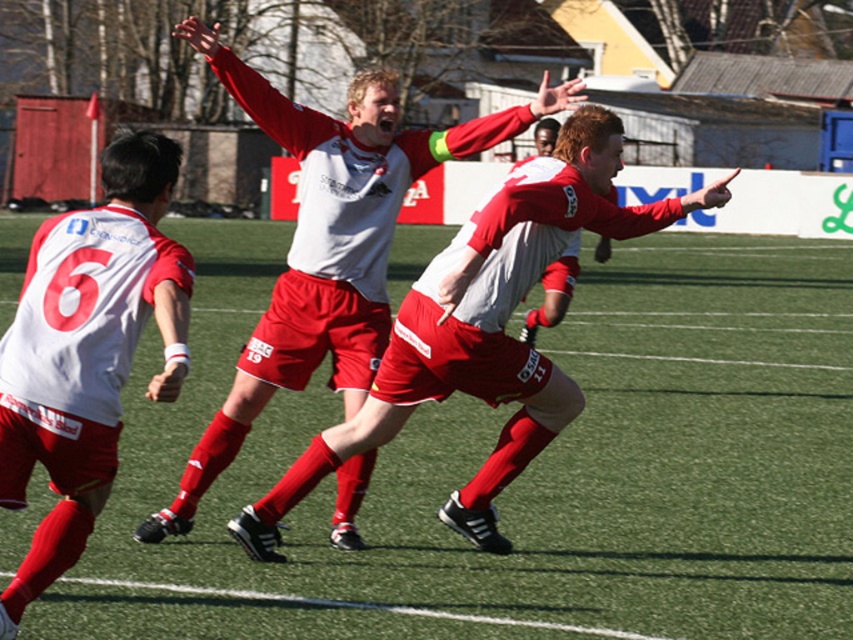
Does matte red shorts at center appear on the right side of white matte jersey at left?

Indeed, matte red shorts at center is positioned on the right side of white matte jersey at left.

Between matte red shorts at center and white matte jersey at left, which one appears on the right side from the viewer's perspective?

matte red shorts at center

Between point (390, 360) and point (57, 330), which one is positioned behind?

The point (390, 360) is more distant.

You are a GUI agent. You are given a task and a screenshot of the screen. Output one action in this format:
    pyautogui.click(x=<x>, y=<y>)
    Task: Click on the matte red shorts at center
    
    Given the screenshot: What is the action you would take?
    pyautogui.click(x=483, y=330)